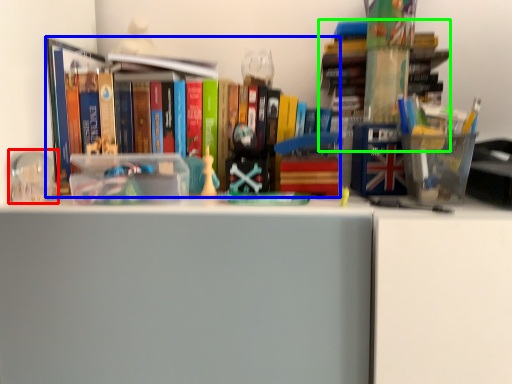
Question: Based on their relative distances, which object is nearer to toy (highlighted by a red box)? Choose from book (highlighted by a blue box) and book (highlighted by a green box).

Choices:
 (A) book
 (B) book

Answer: (A)